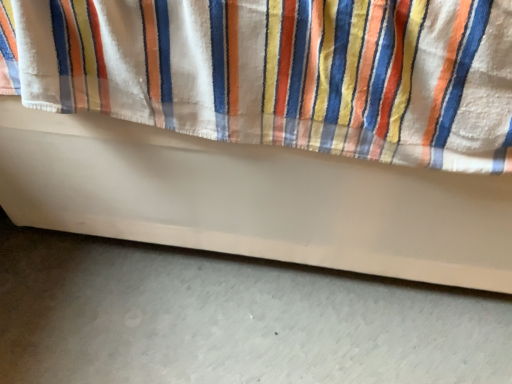
Identify the location of blank space situated above gray matte concrete at lower center (from a real-world perspective). (198, 316).